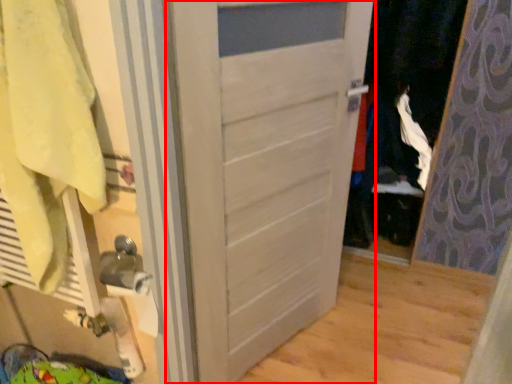
Question: In this image, where is door (annotated by the red box) located relative to bath towel?

Choices:
 (A) left
 (B) right

Answer: (B)